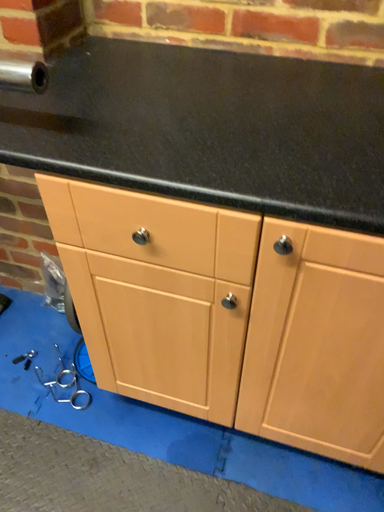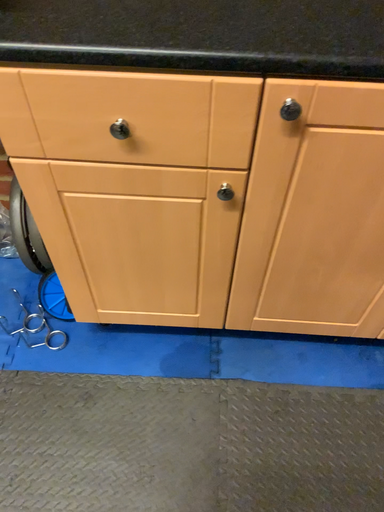
Question: Which way did the camera rotate in the video?

Choices:
 (A) rotated left
 (B) rotated right

Answer: (B)